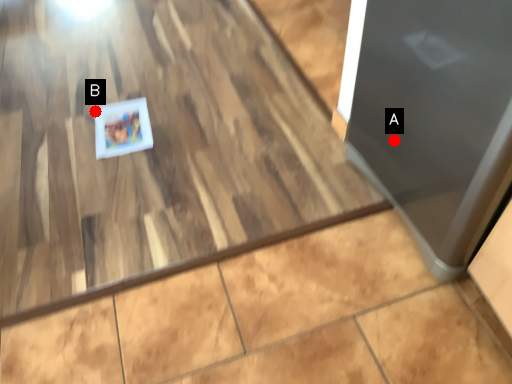
Question: Two points are circled on the image, labeled by A and B beside each circle. Which point is farther from the camera taking this photo?

Choices:
 (A) A is further
 (B) B is further

Answer: (B)